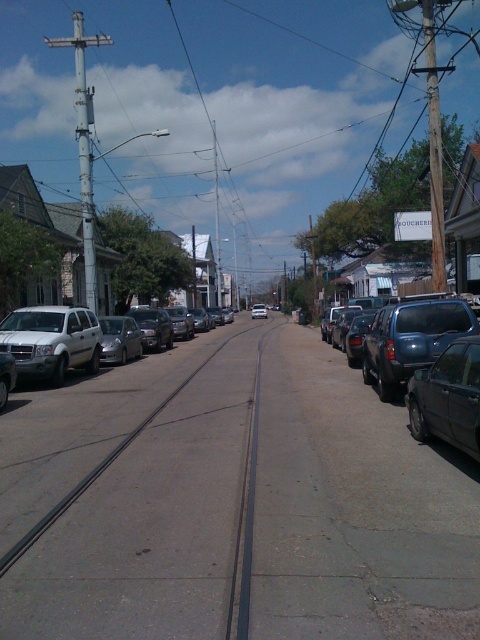
Who is lower down, gray concrete pavement at center or metallic blue sedan at right?

gray concrete pavement at center

Who is more distant from viewer, (135, 376) or (387, 390)?

Point (135, 376)

Locate an element on the screen. The image size is (480, 640). gray concrete pavement at center is located at coordinates (232, 502).

Which of these two, gray concrete pavement at center or silver metallic suv at left, stands taller?

silver metallic suv at left is taller.

Is point (59, 548) positioned in front of point (98, 328)?

Yes, it is.

This screenshot has width=480, height=640. What are the coordinates of `gray concrete pavement at center` in the screenshot? It's located at (232, 502).

Which is more to the left, gray concrete pavement at center or shiny black sedan at right?

gray concrete pavement at center is more to the left.

What do you see at coordinates (232, 502) in the screenshot?
I see `gray concrete pavement at center` at bounding box center [232, 502].

At what (x,y) coordinates should I click in order to perform the action: click on gray concrete pavement at center. Please return your answer as a coordinate pair (x, y). Looking at the image, I should click on (232, 502).